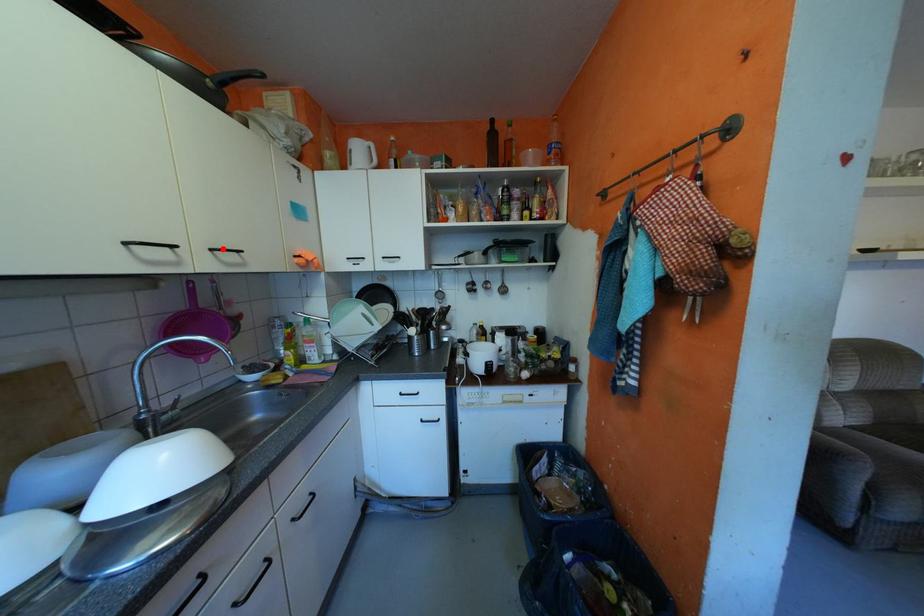
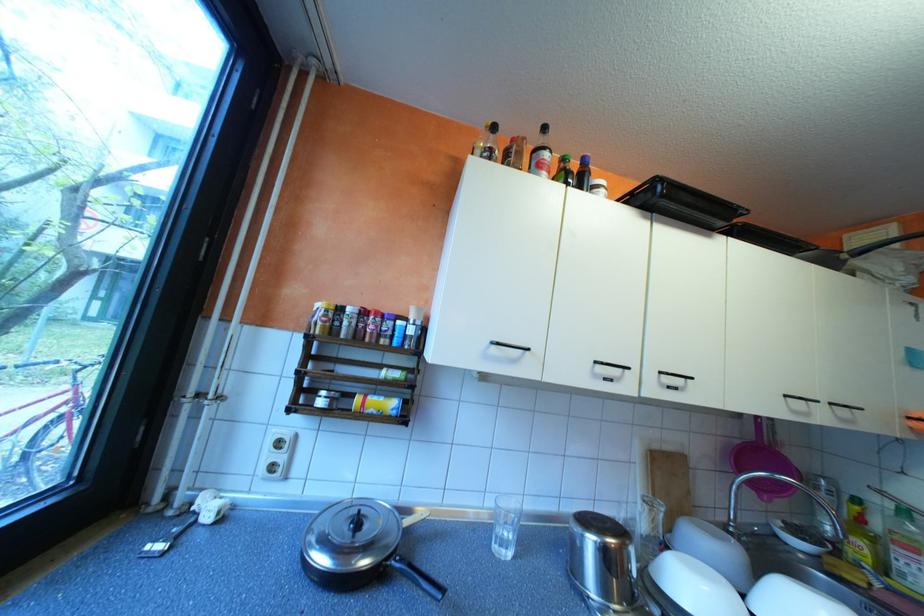
The point at the highlighted location is marked in the first image. Where is the corresponding point in the second image?

(843, 403)